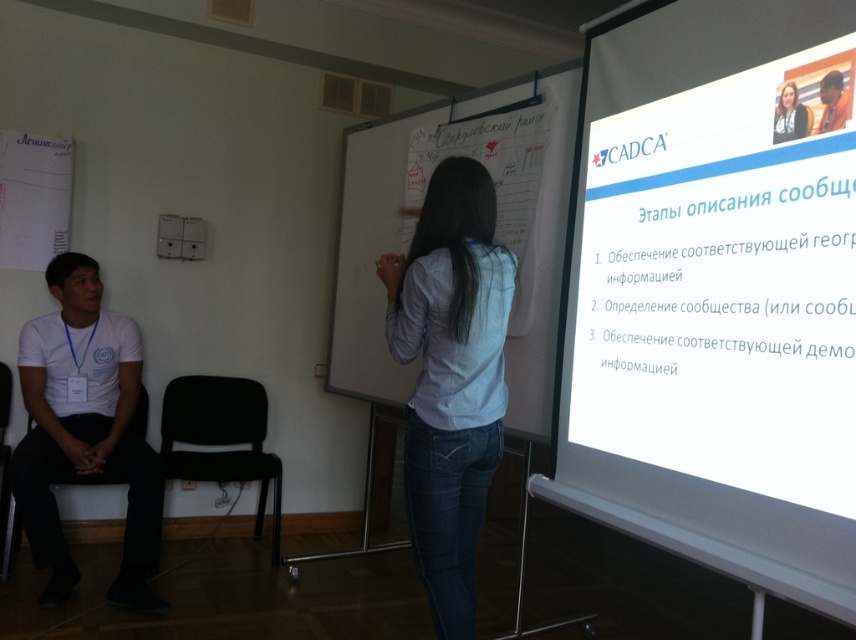
You are standing in the classroom and need to move from the black plastic chair at left to the matte black hair at upper right. Which direction should you move?

You should move to the right because the black plastic chair at left is to the left of matte black hair at upper right.

You are standing in the classroom and need to locate the white paper at right. According to the coordinates given, where should you look?

The white paper at right is located at the coordinates point (715, 292).